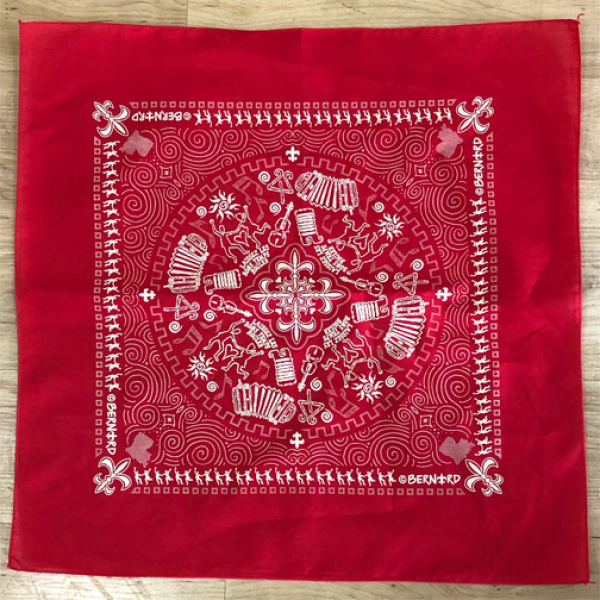
Locate an element on the screen. light brown wall is located at coordinates (310, 16).